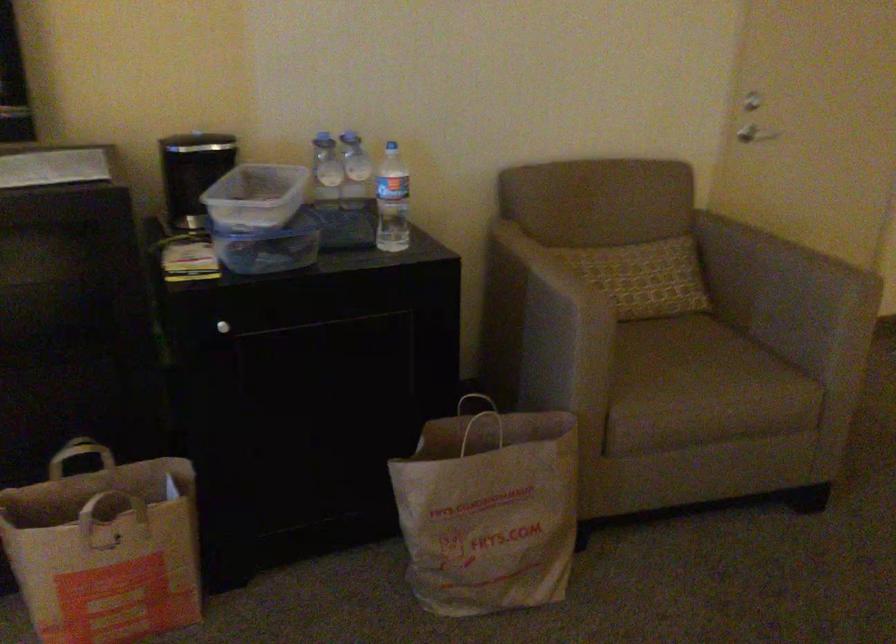
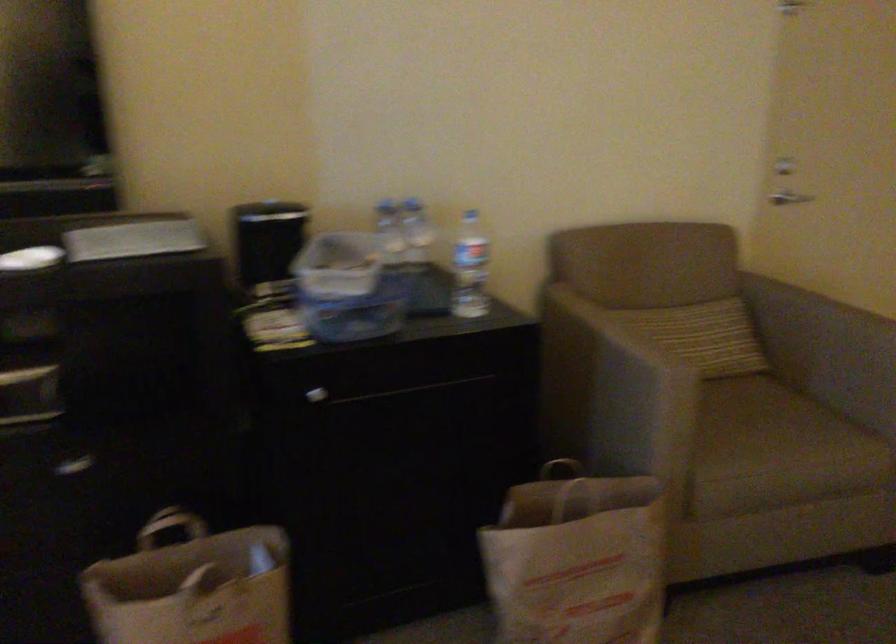
Locate, in the second image, the point that corresponds to pixel 494 428 in the first image.

(576, 493)